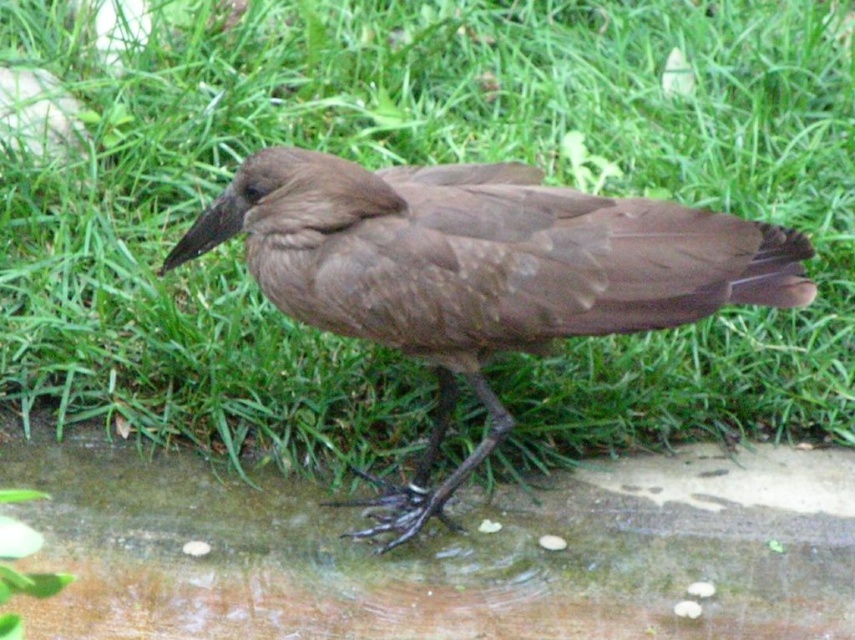
You are a photographer aiming to capture the Hammerhead Stork in the image. You want to position your camera so that the bird is centered between the green grass at center and the brown glossy puddle at lower center. Which direction should you move the camera to achieve this?

The green grass at center is to the right of the brown glossy puddle at lower center. To center the bird between them, move the camera to the right so that the bird is equidistant from both the green grass at center and the brown glossy puddle at lower center.

You are a small insect trying to cross from the green grass at center to the brown glossy puddle at lower center. Which path would require you to travel a shorter distance? Please explain your reasoning based on the scene description.

The brown glossy puddle at lower center is smaller than the green grass at center. Therefore, the shorter path would be to go directly towards the brown glossy puddle at lower center since it occupies less area compared to the green grass at center.